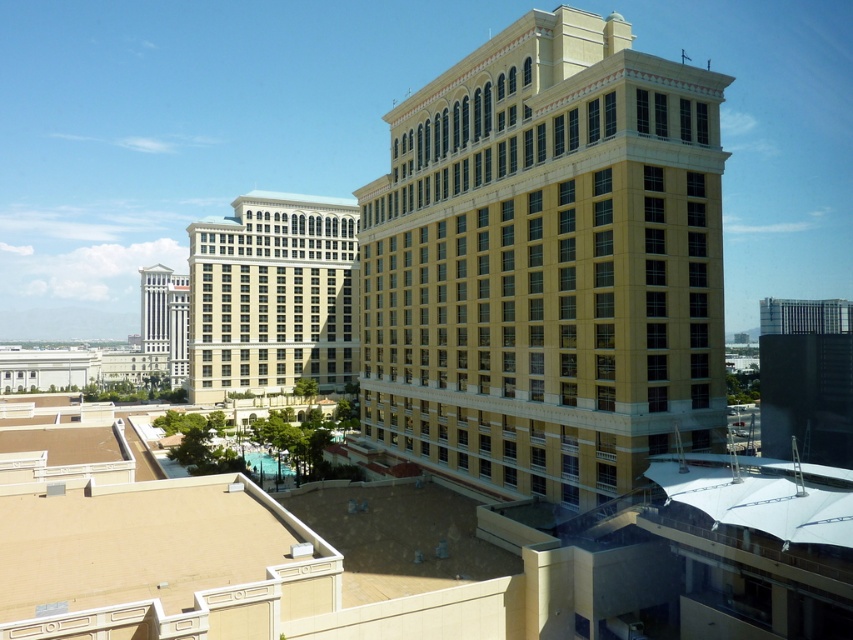
You are a drone operator trying to deliver a package to the yellow stone building at center. Your drone is currently at the point with coordinates point (547, 262). Is the drone currently above the yellow stone building at center?

The point (547, 262) indicates the yellow stone building at center, so yes, the drone is currently above the yellow stone building at center.

Please provide the coordinates of the yellow stone building at center in the image. The coordinate system starts at the bottom left corner of the image with the origin point as 0.0,0.0 and the maximum point as 1.0,1.0.

The yellow stone building at center is located at coordinates point (547,262).